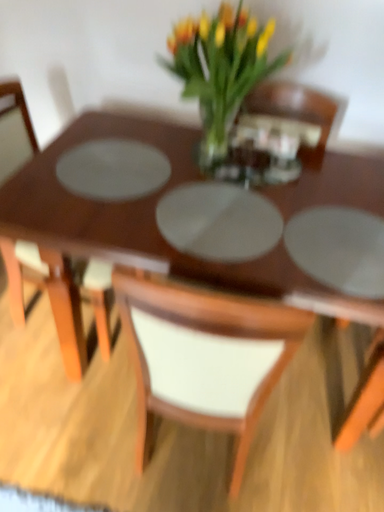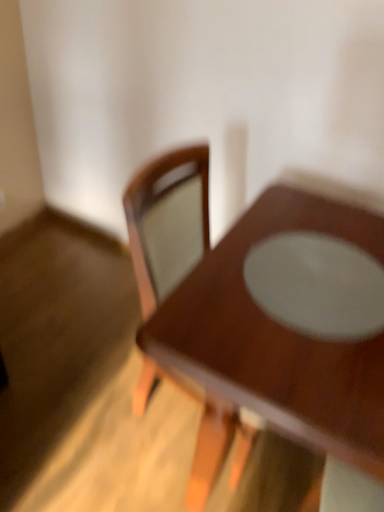
Question: Which way did the camera rotate in the video?

Choices:
 (A) rotated left
 (B) rotated right

Answer: (A)